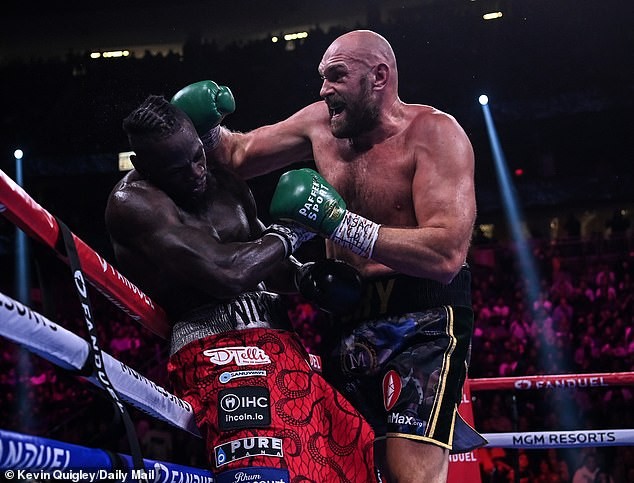
Where is `bright light`? This screenshot has height=483, width=634. bright light is located at coordinates (18, 154), (93, 54), (113, 56), (299, 34), (274, 40), (482, 100), (495, 14).